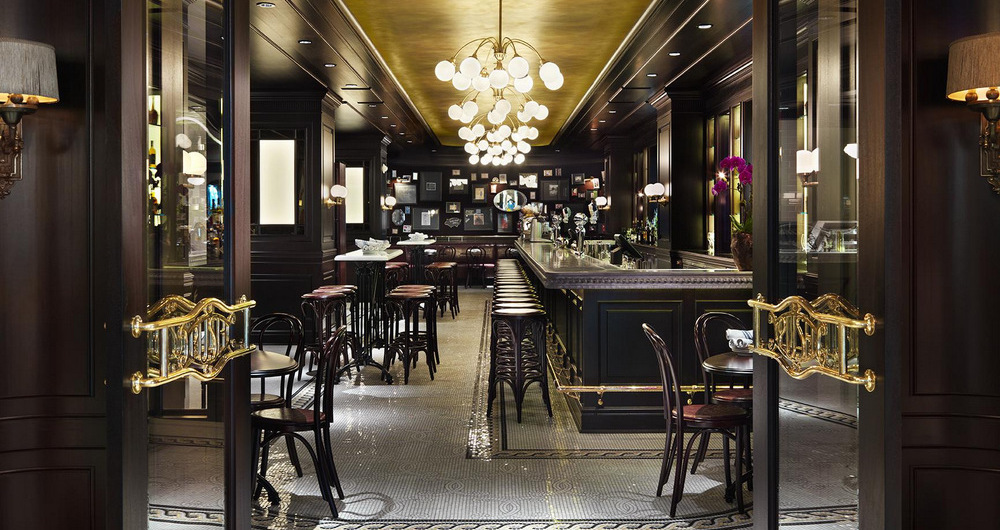
Locate an element on the screen. Image resolution: width=1000 pixels, height=530 pixels. wall mounted lights is located at coordinates (331, 190), (344, 190), (391, 203), (604, 200), (644, 188), (656, 192), (802, 163), (980, 92), (26, 93).